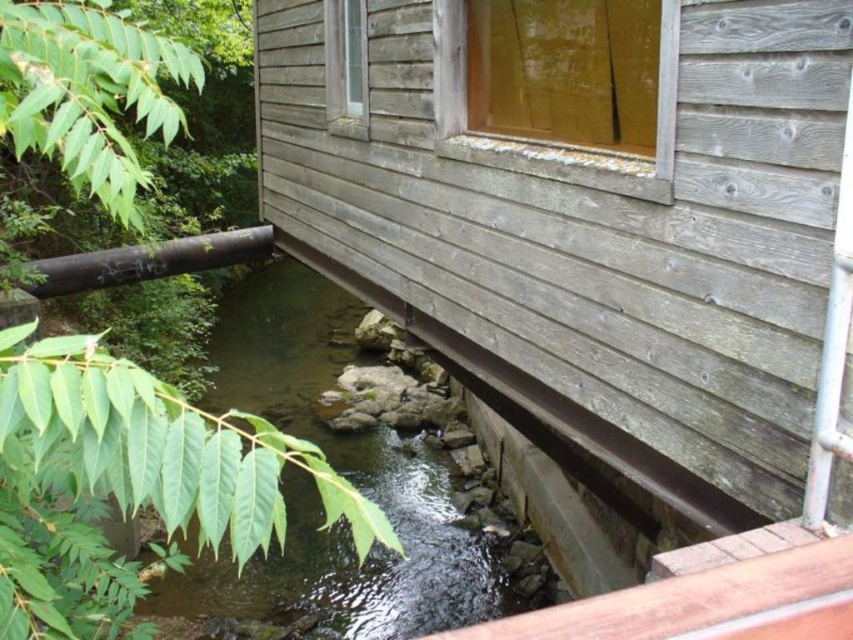
Can you confirm if clear water at center is smaller than black metal pipe at lower left?

Incorrect, clear water at center is not smaller in size than black metal pipe at lower left.

I want to click on clear water at center, so click(343, 474).